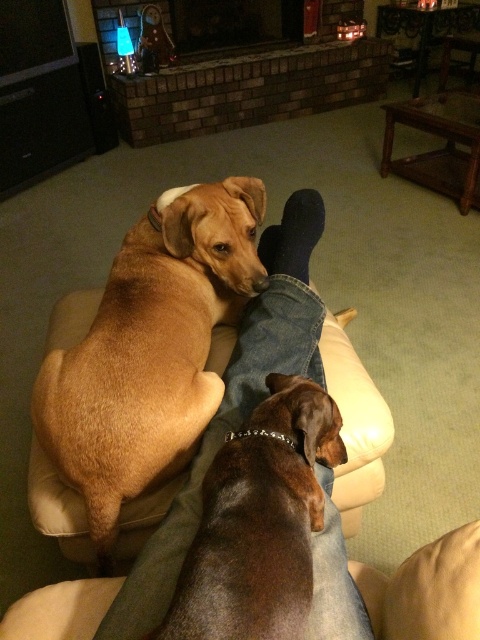
What is located at the coordinate point (151, 349) in the image?

The point (151, 349) corresponds to the brown furry dog at center.

You are a photographer setting up a shot of the scene. You want to ensure both the brown furry dog at center and the brick fireplace at upper center are in frame. Based on their positions, which object is closer to the left edge of the photo?

The brown furry dog at center is positioned on the left side of brick fireplace at upper center, so it is closer to the left edge of the photo.

You are a guest in this living room and want to place a small plant on the mantel of the brick fireplace at upper center. However, you need to ensure that the plant won not be knocked over by the brown shiny dog at center. Can you place the plant there safely?

The brown shiny dog at center is positioned under the brick fireplace at upper center, so placing the plant on the mantel should be safe as the dog cannot reach it from below.